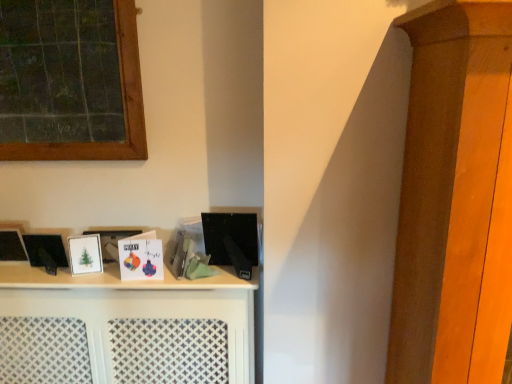
Question: Is matte black book at center, which appears as the first book when viewed from the right, closer to the viewer compared to white matte picture frame at left?

Choices:
 (A) yes
 (B) no

Answer: (A)

Question: Can you confirm if matte black book at center, which appears as the first book when viewed from the right, is thinner than white matte picture frame at left?

Choices:
 (A) yes
 (B) no

Answer: (A)

Question: Can you confirm if matte black book at center, which appears as the first book when viewed from the right, is positioned to the right of white matte picture frame at left?

Choices:
 (A) yes
 (B) no

Answer: (A)

Question: Can you confirm if matte black book at center, which appears as the first book when viewed from the right, is smaller than white matte picture frame at left?

Choices:
 (A) yes
 (B) no

Answer: (A)

Question: Is matte black book at center, which appears as the first book when viewed from the right, not close to white matte picture frame at left?

Choices:
 (A) yes
 (B) no

Answer: (B)

Question: Is matte black book at center, which is the 2th book from left to right, outside of white matte picture frame at left?

Choices:
 (A) yes
 (B) no

Answer: (A)

Question: Does green chalkboard at upper left have a larger size compared to matte black book at center, which is the 2th book from left to right?

Choices:
 (A) yes
 (B) no

Answer: (A)

Question: Is green chalkboard at upper left wider than matte black book at center, which is the 2th book from left to right?

Choices:
 (A) yes
 (B) no

Answer: (B)

Question: Is green chalkboard at upper left in front of matte black book at center, which appears as the first book when viewed from the right?

Choices:
 (A) yes
 (B) no

Answer: (A)

Question: Is matte black book at center, which appears as the first book when viewed from the right, inside green chalkboard at upper left?

Choices:
 (A) no
 (B) yes

Answer: (A)

Question: Are green chalkboard at upper left and matte black book at center, which appears as the first book when viewed from the right, far apart?

Choices:
 (A) yes
 (B) no

Answer: (B)

Question: Is green chalkboard at upper left at the right side of matte black book at center, which is the 2th book from left to right?

Choices:
 (A) yes
 (B) no

Answer: (B)

Question: Is white matte shelf at center positioned far away from matte black book at center, which is the 2th book from left to right?

Choices:
 (A) no
 (B) yes

Answer: (A)